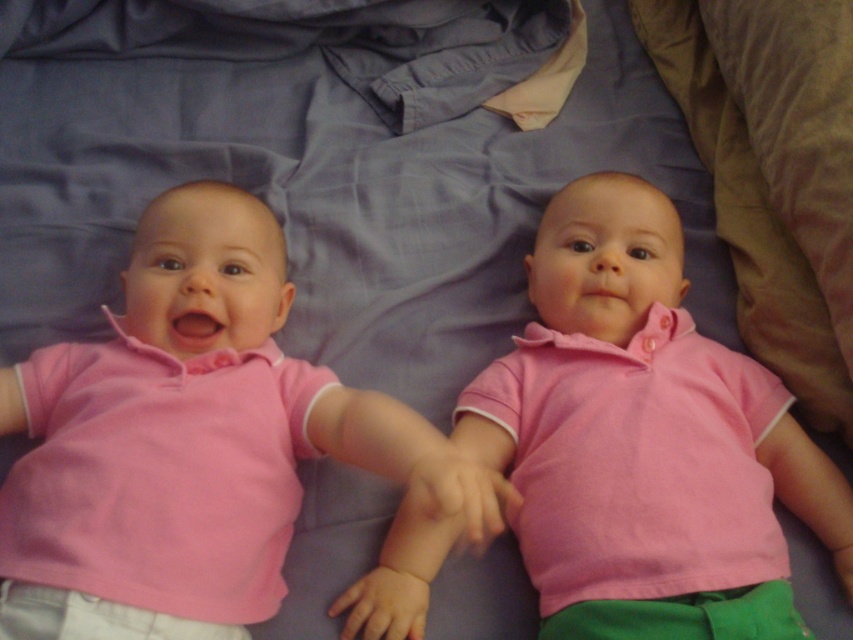
Question: Which of the following is the closest to the observer?

Choices:
 (A) (708, 445)
 (B) (254, 492)

Answer: (B)

Question: Which point appears farthest from the camera in this image?

Choices:
 (A) (599, 209)
 (B) (212, 212)

Answer: (A)

Question: Does matte pink shirt at center have a smaller size compared to pink cotton shirt at center?

Choices:
 (A) yes
 (B) no

Answer: (A)

Question: Can you confirm if matte pink shirt at center is thinner than pink cotton shirt at center?

Choices:
 (A) yes
 (B) no

Answer: (A)

Question: Is matte pink shirt at center to the right of pink cotton shirt at center from the viewer's perspective?

Choices:
 (A) yes
 (B) no

Answer: (B)